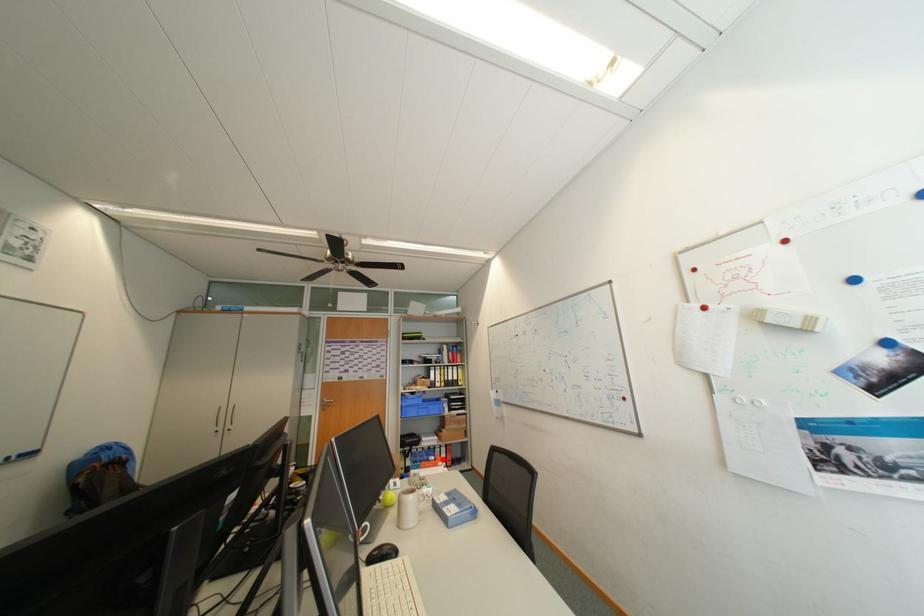
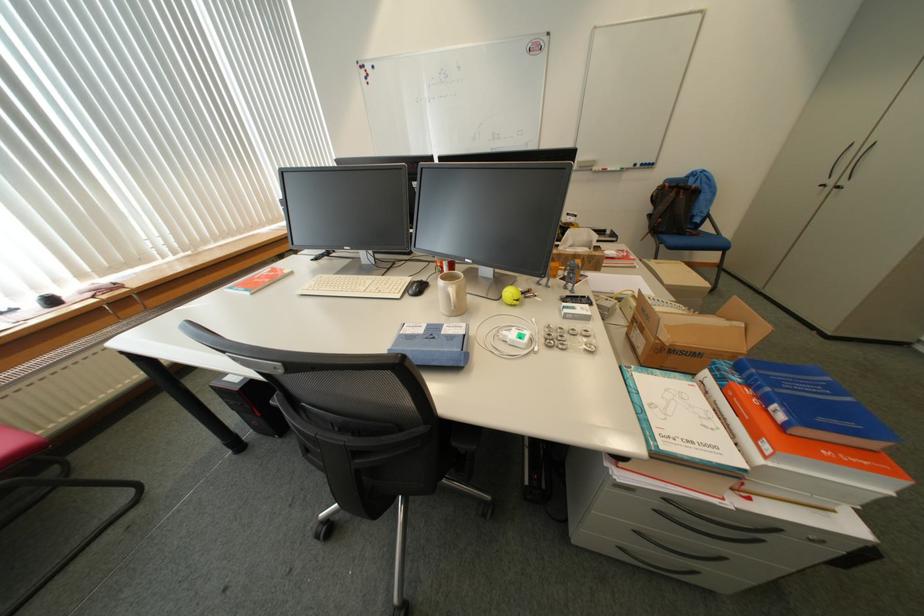
The point at the highlighted location is marked in the first image. Where is the corresponding point in the second image?

(791, 418)